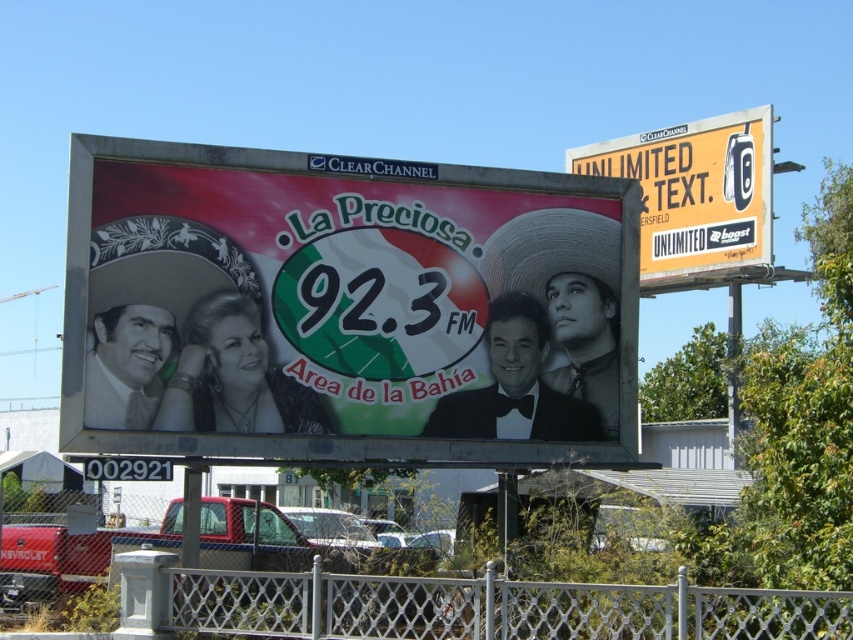
Question: Can you confirm if matte plastic billboard at center is bigger than yellow paper sign at upper right?

Choices:
 (A) no
 (B) yes

Answer: (A)

Question: Which of the following is the farthest from the observer?

Choices:
 (A) (770, 237)
 (B) (592, 180)

Answer: (A)

Question: Which object is farther from the camera taking this photo?

Choices:
 (A) matte plastic billboard at center
 (B) yellow paper sign at upper right

Answer: (B)

Question: Is matte plastic billboard at center wider than yellow paper sign at upper right?

Choices:
 (A) yes
 (B) no

Answer: (A)

Question: Among these points, which one is nearest to the camera?

Choices:
 (A) (767, 106)
 (B) (544, 376)

Answer: (B)

Question: Does matte plastic billboard at center have a larger size compared to yellow paper sign at upper right?

Choices:
 (A) yes
 (B) no

Answer: (B)